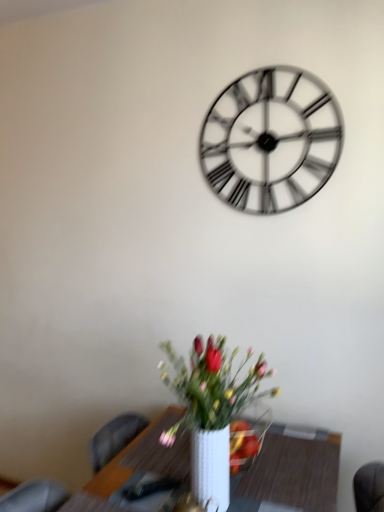
Question: Is metallic silver clock at upper center not near white ceramic vase at lower center?

Choices:
 (A) yes
 (B) no

Answer: (B)

Question: Does metallic silver clock at upper center have a lesser width compared to white ceramic vase at lower center?

Choices:
 (A) yes
 (B) no

Answer: (A)

Question: Can we say metallic silver clock at upper center lies outside white ceramic vase at lower center?

Choices:
 (A) yes
 (B) no

Answer: (A)

Question: From a real-world perspective, is metallic silver clock at upper center physically below white ceramic vase at lower center?

Choices:
 (A) no
 (B) yes

Answer: (A)

Question: Can you confirm if metallic silver clock at upper center is bigger than white ceramic vase at lower center?

Choices:
 (A) no
 (B) yes

Answer: (A)

Question: Is metallic silver clock at upper center looking in the opposite direction of white ceramic vase at lower center?

Choices:
 (A) no
 (B) yes

Answer: (A)

Question: Is white ceramic vase at lower center smaller than white glossy table at lower center?

Choices:
 (A) no
 (B) yes

Answer: (B)

Question: Is white ceramic vase at lower center looking in the opposite direction of white glossy table at lower center?

Choices:
 (A) no
 (B) yes

Answer: (A)

Question: Is white ceramic vase at lower center bigger than white glossy table at lower center?

Choices:
 (A) no
 (B) yes

Answer: (A)

Question: Can you confirm if white ceramic vase at lower center is positioned to the right of white glossy table at lower center?

Choices:
 (A) yes
 (B) no

Answer: (B)

Question: Is white ceramic vase at lower center oriented towards white glossy table at lower center?

Choices:
 (A) yes
 (B) no

Answer: (B)

Question: Is white ceramic vase at lower center closer to camera compared to white glossy table at lower center?

Choices:
 (A) no
 (B) yes

Answer: (B)

Question: Could white glossy table at lower center be considered to be inside metallic silver clock at upper center?

Choices:
 (A) no
 (B) yes

Answer: (A)